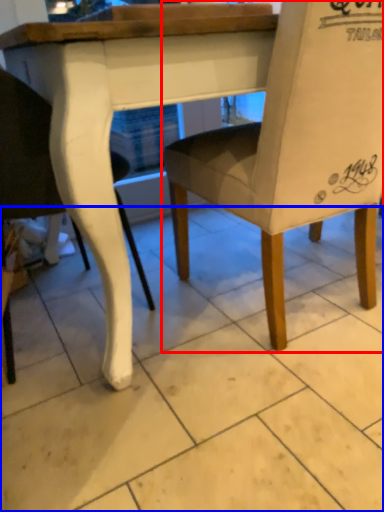
Question: Which of the following is the closest to the observer, chair (highlighted by a red box) or tile (highlighted by a blue box)?

Choices:
 (A) chair
 (B) tile

Answer: (B)